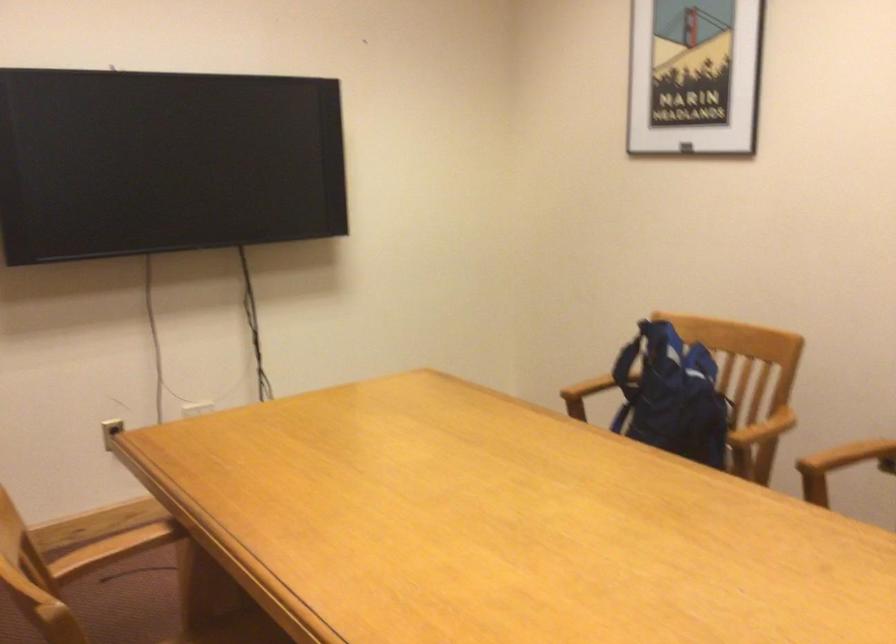
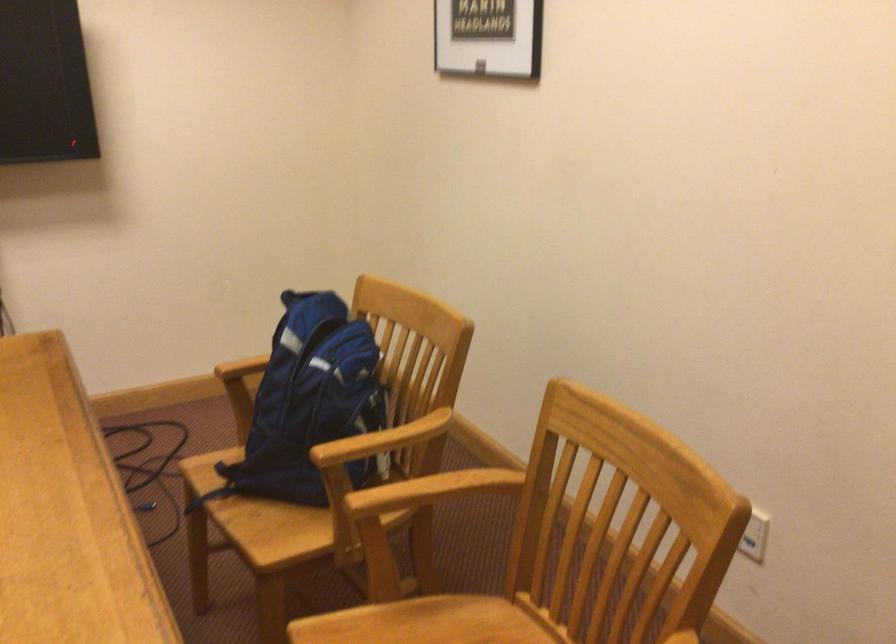
In the second image, find the point that corresponds to the point at 569,391 in the first image.

(242, 368)